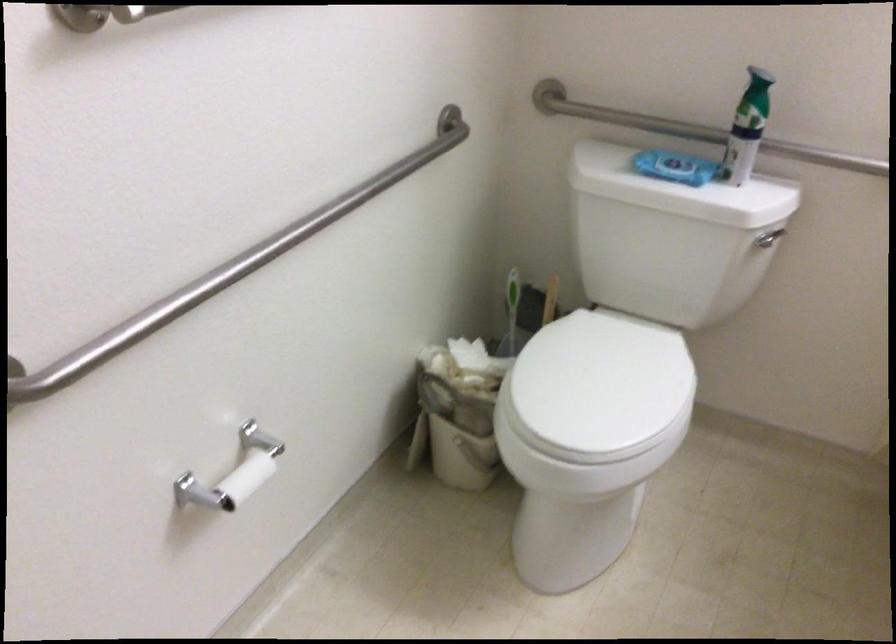
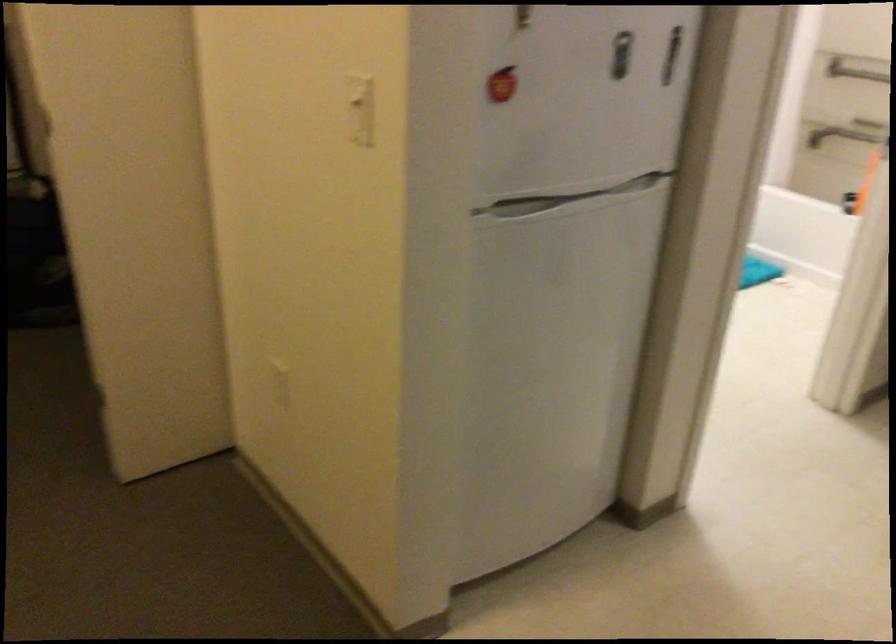
Question: I am providing you with two images of the same scene from different viewpoints. Which of the following objects are not visible in image2?

Choices:
 (A) red apple magnet
 (B) white toilet tank lid
 (C) refrigerator handle
 (D) bag zipper pull

Answer: (B)